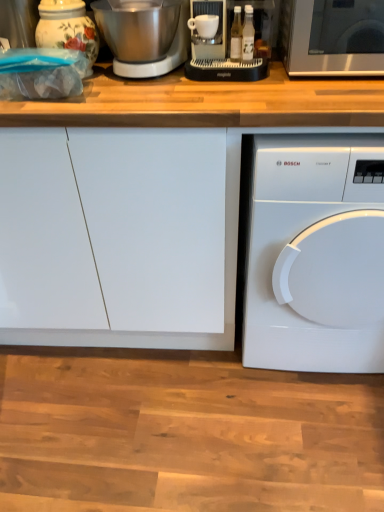
Question: Does white glossy dishwasher at lower right appear on the right side of brushed metal mixer at upper left?

Choices:
 (A) yes
 (B) no

Answer: (A)

Question: From a real-world perspective, does white glossy dishwasher at lower right stand above brushed metal mixer at upper left?

Choices:
 (A) no
 (B) yes

Answer: (A)

Question: Is brushed metal mixer at upper left at the back of white glossy dishwasher at lower right?

Choices:
 (A) yes
 (B) no

Answer: (B)

Question: Is white glossy dishwasher at lower right bigger than brushed metal mixer at upper left?

Choices:
 (A) no
 (B) yes

Answer: (B)

Question: Is white glossy dishwasher at lower right wider than brushed metal mixer at upper left?

Choices:
 (A) yes
 (B) no

Answer: (A)

Question: Is the position of white glossy dishwasher at lower right more distant than that of brushed metal mixer at upper left?

Choices:
 (A) yes
 (B) no

Answer: (B)

Question: Does porcelain floral jar at upper left have a greater height compared to brushed metal mixer at upper left?

Choices:
 (A) no
 (B) yes

Answer: (B)

Question: Considering the relative positions of porcelain floral jar at upper left and brushed metal mixer at upper left in the image provided, is porcelain floral jar at upper left in front of brushed metal mixer at upper left?

Choices:
 (A) no
 (B) yes

Answer: (A)

Question: From a real-world perspective, is porcelain floral jar at upper left beneath brushed metal mixer at upper left?

Choices:
 (A) yes
 (B) no

Answer: (B)

Question: From the image's perspective, is porcelain floral jar at upper left located beneath brushed metal mixer at upper left?

Choices:
 (A) no
 (B) yes

Answer: (B)

Question: Is porcelain floral jar at upper left looking in the opposite direction of brushed metal mixer at upper left?

Choices:
 (A) yes
 (B) no

Answer: (B)

Question: Is porcelain floral jar at upper left further to the viewer compared to brushed metal mixer at upper left?

Choices:
 (A) no
 (B) yes

Answer: (B)

Question: From a real-world perspective, is white glossy dishwasher at lower right located higher than porcelain floral jar at upper left?

Choices:
 (A) no
 (B) yes

Answer: (A)